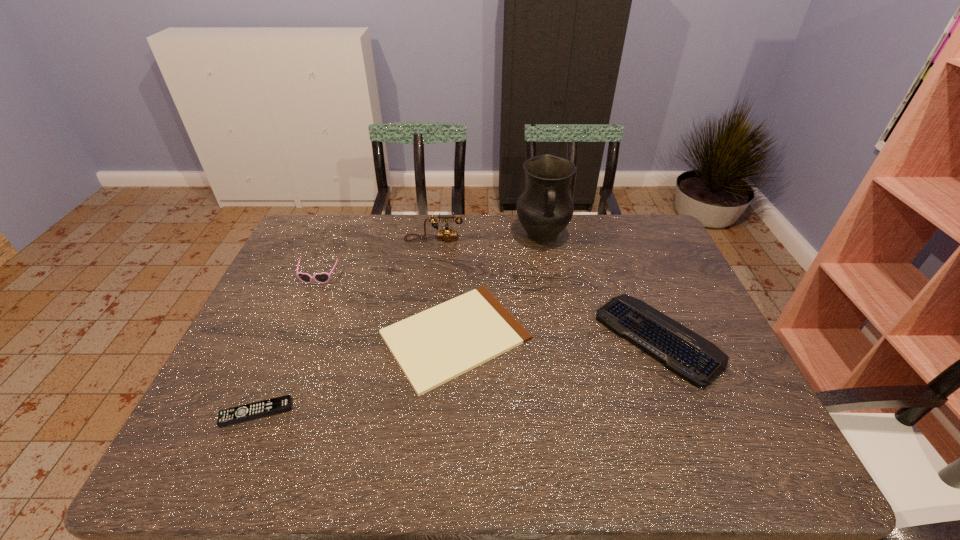
In the image, there is a desktop. Where is `vacant space at the far edge`? The width and height of the screenshot is (960, 540). vacant space at the far edge is located at coordinates (573, 253).

Where is `vacant space at the left edge of the desktop`? vacant space at the left edge of the desktop is located at coordinates (259, 350).

In the image, there is a desktop. Identify the location of free space at the right edge. (673, 257).

In the image, there is a desktop. Where is `free space at the far left corner`? free space at the far left corner is located at coordinates (311, 253).

The image size is (960, 540). I want to click on vacant space at the near right corner of the desktop, so click(769, 463).

This screenshot has width=960, height=540. In order to click on free space between the shortest object and the pitcher in this screenshot , I will do `click(498, 286)`.

Image resolution: width=960 pixels, height=540 pixels. I want to click on empty space that is in between the pitcher and the rightmost object, so click(600, 287).

Where is `free spot between the tallest object and the telephone`? free spot between the tallest object and the telephone is located at coordinates (488, 238).

The width and height of the screenshot is (960, 540). Identify the location of free space that is in between the fifth shortest object and the sunglasses. (376, 258).

What are the coordinates of `free point between the nearest object and the clipboard` in the screenshot? It's located at (355, 374).